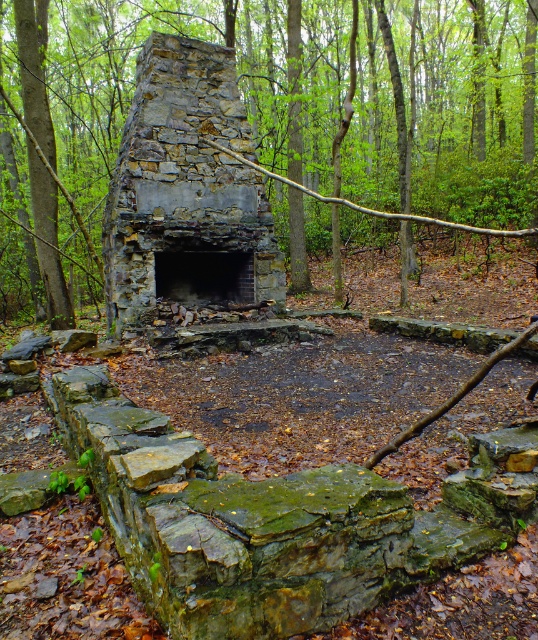
You are a contractor assessing the structural integrity of the fireplace and chimney. Given that the rustic stone fireplace at center is 2 meters wide, can you determine if the green mossy stone chimney at center is wider than the fireplace?

The green mossy stone chimney at center is wider than rustic stone fireplace at center, so yes, the chimney is wider than the fireplace.

You are standing in front of the fireplace and want to place a decorative item on the lower part of the fireplace structure. Which part should you choose between the rustic stone fireplace at center and the dark gray stone fireplace at center?

The dark gray stone fireplace at center is the lower part, so you should place the decorative item there.